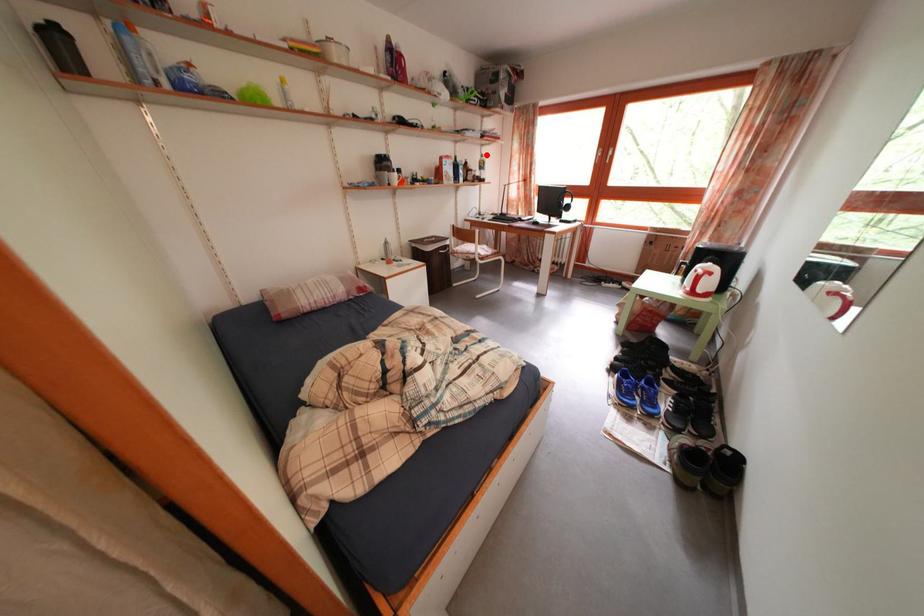
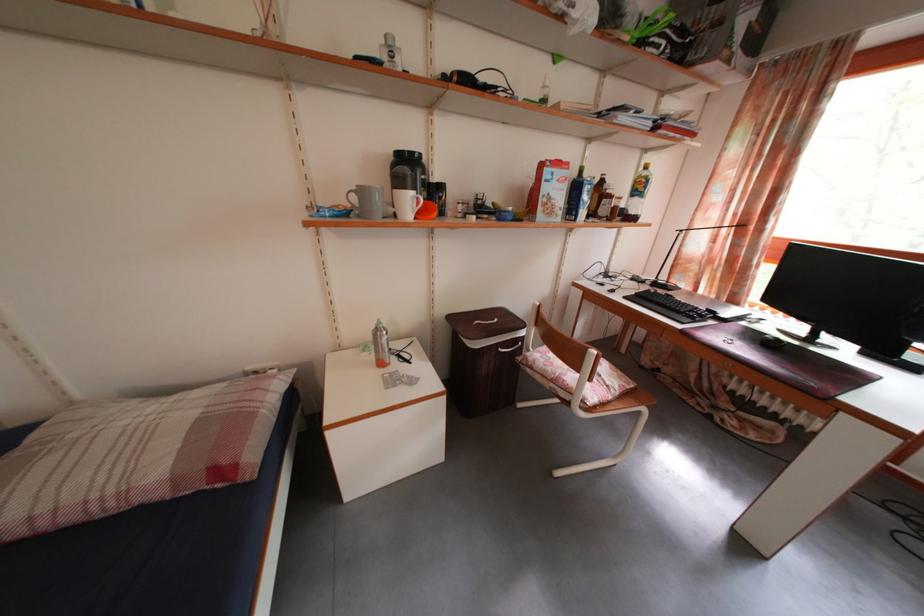
Question: I am providing you with two images of the same scene from different viewpoints. In image1, a red point is highlighted. Considering the same 3D point in image2, which of the following is correct?

Choices:
 (A) It is closer
 (B) It is farther

Answer: (B)